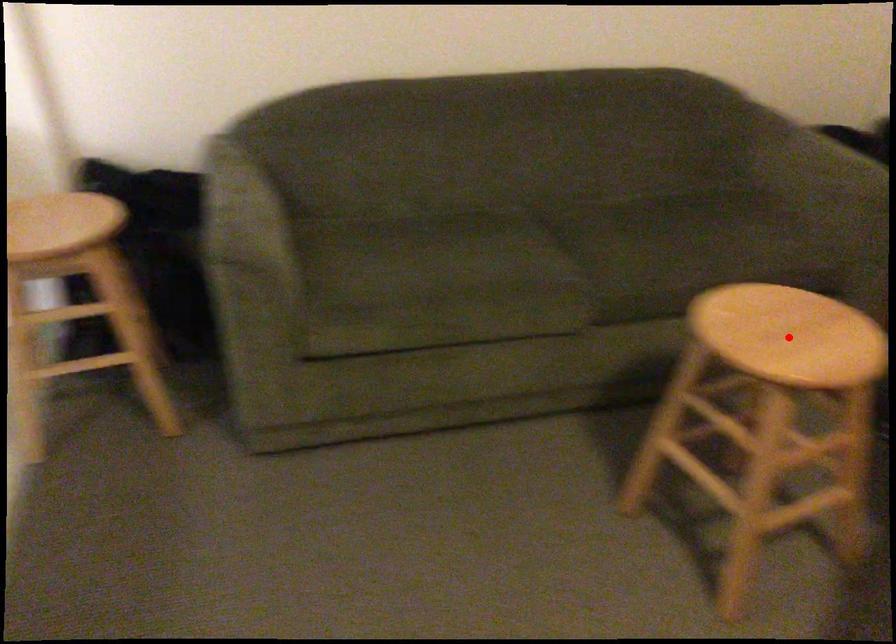
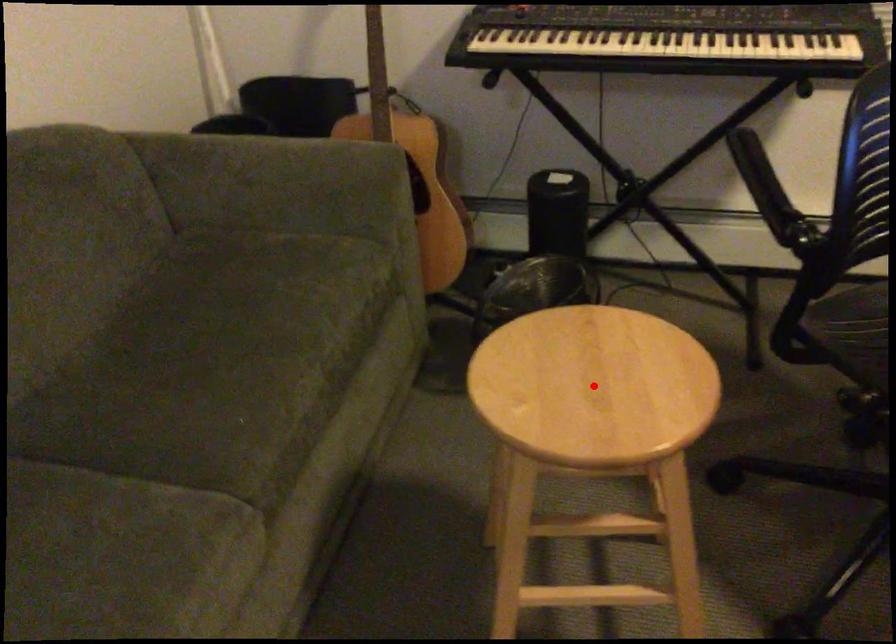
I am providing you with two images of the same scene from different viewpoints. A red point is marked on the first image and another point is marked on the second image. Is the marked point in image1 the same physical position as the marked point in image2?

Yes